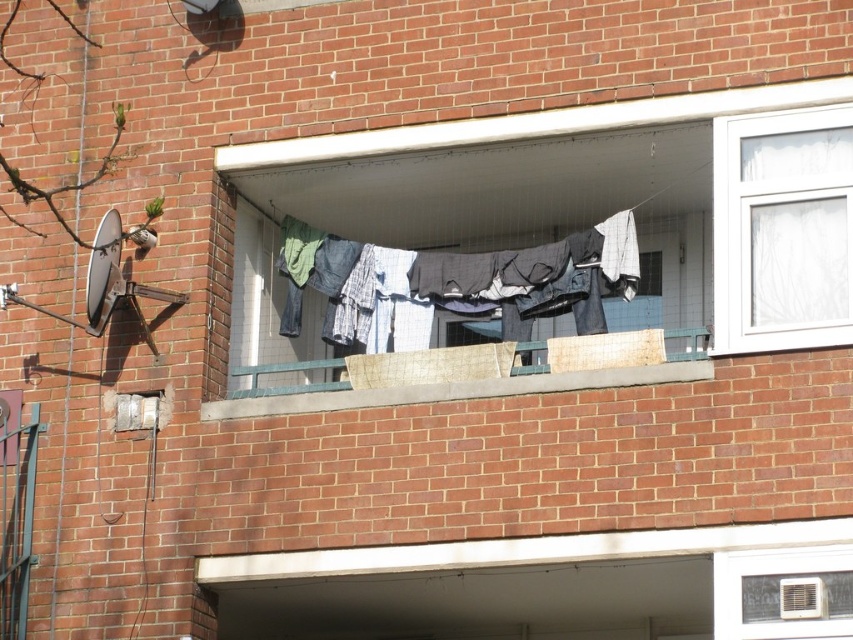
Question: Can you confirm if blue cotton clothes at center is positioned below wooden planks at center?

Choices:
 (A) yes
 (B) no

Answer: (B)

Question: In this image, where is white plastic window at upper right located relative to wooden planks at center?

Choices:
 (A) right
 (B) left

Answer: (A)

Question: Which object appears farthest from the camera in this image?

Choices:
 (A) wooden planks at center
 (B) blue cotton clothes at center
 (C) white plastic window at upper right

Answer: (B)

Question: Which object appears closest to the camera in this image?

Choices:
 (A) wooden planks at center
 (B) white plastic window at upper right
 (C) blue cotton clothes at center

Answer: (B)

Question: Does white plastic window at upper right appear under wooden planks at center?

Choices:
 (A) yes
 (B) no

Answer: (B)

Question: Based on their relative distances, which object is nearer to the wooden planks at center?

Choices:
 (A) blue cotton clothes at center
 (B) white plastic window at upper right

Answer: (B)